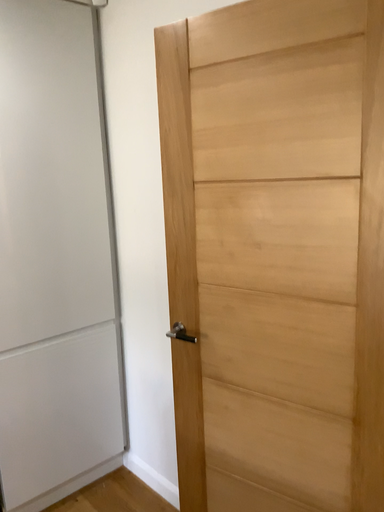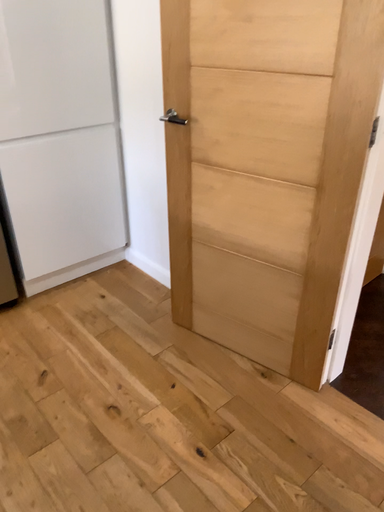
Question: How did the camera likely rotate when shooting the video?

Choices:
 (A) rotated downward
 (B) rotated upward

Answer: (A)